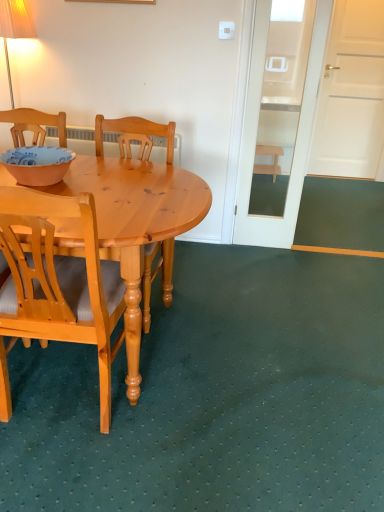
The height and width of the screenshot is (512, 384). What do you see at coordinates (270, 164) in the screenshot? I see `wooden stool at right` at bounding box center [270, 164].

The image size is (384, 512). Find the location of `wooden stool at right`. wooden stool at right is located at coordinates (270, 164).

Is light brown wood chair at left, which is counted as the second chair, starting from the back, completely or partially inside matte orange bowl at left?

That's incorrect, light brown wood chair at left, which is counted as the second chair, starting from the back, is not inside matte orange bowl at left.

Does matte orange bowl at left have a greater width compared to light brown wood chair at left, positioned as the 1th chair in front-to-back order?

No, matte orange bowl at left is not wider than light brown wood chair at left, positioned as the 1th chair in front-to-back order.

Could you tell me if wooden stool at right is turned towards light brown wood chair at left, which is counted as the second chair, starting from the back?

Yes.

Does wooden stool at right have a greater width compared to light brown wood chair at left, positioned as the 1th chair in front-to-back order?

No.

From the image's perspective, who appears lower, wooden stool at right or light brown wood chair at left, positioned as the 1th chair in front-to-back order?

light brown wood chair at left, positioned as the 1th chair in front-to-back order, appears lower in the image.

Is wooden stool at right to the left or to the right of light brown wood chair at left, which is counted as the second chair, starting from the back, in the image?

From the image, it's evident that wooden stool at right is to the right of light brown wood chair at left, which is counted as the second chair, starting from the back.

Considering the sizes of objects wooden stool at right and matte orange bowl at left in the image provided, who is wider, wooden stool at right or matte orange bowl at left?

With larger width is wooden stool at right.

Considering the positions of point (276, 153) and point (63, 166), is point (276, 153) closer or farther from the camera than point (63, 166)?

Point (276, 153).

From a real-world perspective, is wooden stool at right beneath matte orange bowl at left?

Yes, from a real-world perspective, wooden stool at right is below matte orange bowl at left.

Considering the positions of points (57, 148) and (256, 148), is point (57, 148) farther from camera compared to point (256, 148)?

No.

What's the angular difference between matte orange bowl at left and wooden stool at right's facing directions?

They differ by 90.9 degrees in their facing directions.

Considering the sizes of matte orange bowl at left and wooden stool at right in the image, is matte orange bowl at left taller or shorter than wooden stool at right?

matte orange bowl at left is shorter than wooden stool at right.

I want to click on bowl in front of the wooden stool at right, so click(37, 164).

From a real-world perspective, is light brown wood chair at left, which is counted as the second chair, starting from the back, above or below light wood chair at center, which ranks as the first chair in back-to-front order?

In terms of real-world spatial position, light brown wood chair at left, which is counted as the second chair, starting from the back, is below light wood chair at center, which ranks as the first chair in back-to-front order.

Locate an element on the screen. This screenshot has height=512, width=384. chair above the light brown wood chair at left, which is counted as the second chair, starting from the back (from a real-world perspective) is located at coordinates (134, 134).

Is light brown wood chair at left, which is counted as the second chair, starting from the back, smaller than light wood chair at center, which ranks as the first chair in back-to-front order?

Actually, light brown wood chair at left, which is counted as the second chair, starting from the back, might be larger than light wood chair at center, which ranks as the first chair in back-to-front order.

Is light brown wood chair at left, which is counted as the second chair, starting from the back, looking in the opposite direction of light wood chair at center, which is the second chair from front to back?

No, light brown wood chair at left, which is counted as the second chair, starting from the back,'s orientation is not away from light wood chair at center, which is the second chair from front to back.

Can you confirm if light brown wood chair at left, which is counted as the second chair, starting from the back, is taller than wooden stool at right?

Yes.

Consider the image. Who is bigger, light brown wood chair at left, positioned as the 1th chair in front-to-back order, or wooden stool at right?

light brown wood chair at left, positioned as the 1th chair in front-to-back order, is bigger.

From the image's perspective, which is below, light brown wood chair at left, positioned as the 1th chair in front-to-back order, or wooden stool at right?

light brown wood chair at left, positioned as the 1th chair in front-to-back order, appears lower in the image.

Can you confirm if light wood chair at center, which ranks as the first chair in back-to-front order, is smaller than matte orange bowl at left?

No.

Does light wood chair at center, which is the second chair from front to back, have a lesser height compared to matte orange bowl at left?

Incorrect, the height of light wood chair at center, which is the second chair from front to back, does not fall short of that of matte orange bowl at left.

Identify the location of bowl located above the light brown wood chair at left, positioned as the 1th chair in front-to-back order (from the image's perspective). (37, 164).

Where is `stool below the light brown wood chair at left, which is counted as the second chair, starting from the back (from a real-world perspective)`? stool below the light brown wood chair at left, which is counted as the second chair, starting from the back (from a real-world perspective) is located at coordinates click(270, 164).

Based on their spatial positions, is light wood chair at center, which ranks as the first chair in back-to-front order, or wooden stool at right further from light brown wood chair at left, positioned as the 1th chair in front-to-back order?

The object further to light brown wood chair at left, positioned as the 1th chair in front-to-back order, is wooden stool at right.

Considering their positions, is light wood chair at center, which ranks as the first chair in back-to-front order, positioned further to light brown wood chair at left, which is counted as the second chair, starting from the back, than matte orange bowl at left?

light wood chair at center, which ranks as the first chair in back-to-front order.

Estimate the real-world distances between objects in this image. Which object is further from wooden stool at right, light wood chair at center, which ranks as the first chair in back-to-front order, or light brown wood chair at left, which is counted as the second chair, starting from the back?

light brown wood chair at left, which is counted as the second chair, starting from the back, is further to wooden stool at right.

From the image, which object appears to be farther from light wood chair at center, which ranks as the first chair in back-to-front order, matte orange bowl at left or light brown wood chair at left, which is counted as the second chair, starting from the back?

light brown wood chair at left, which is counted as the second chair, starting from the back.

Which object lies further to the anchor point matte orange bowl at left, light wood chair at center, which is the second chair from front to back, or light brown wood chair at left, positioned as the 1th chair in front-to-back order?

light brown wood chair at left, positioned as the 1th chair in front-to-back order.

Looking at this image, based on their spatial positions, is matte orange bowl at left or wooden stool at right closer to light wood chair at center, which is the second chair from front to back?

Among the two, matte orange bowl at left is located nearer to light wood chair at center, which is the second chair from front to back.

Looking at the image, which one is located closer to matte orange bowl at left, wooden stool at right or light wood chair at center, which ranks as the first chair in back-to-front order?

Among the two, light wood chair at center, which ranks as the first chair in back-to-front order, is located nearer to matte orange bowl at left.

From the image, which object appears to be farther from matte orange bowl at left, light wood chair at center, which ranks as the first chair in back-to-front order, or wooden stool at right?

The object further to matte orange bowl at left is wooden stool at right.

Locate an element on the screen. The height and width of the screenshot is (512, 384). bowl between light brown wood chair at left, which is counted as the second chair, starting from the back, and light wood chair at center, which is the second chair from front to back, in the front-back direction is located at coordinates (x=37, y=164).

Locate an element on the screen. The width and height of the screenshot is (384, 512). bowl located between light brown wood chair at left, positioned as the 1th chair in front-to-back order, and wooden stool at right in the depth direction is located at coordinates (37, 164).

Locate an element on the screen. This screenshot has width=384, height=512. chair located between light brown wood chair at left, positioned as the 1th chair in front-to-back order, and wooden stool at right in the depth direction is located at coordinates (134, 134).

Locate an element on the screen. chair between matte orange bowl at left and wooden stool at right in the front-back direction is located at coordinates (134, 134).